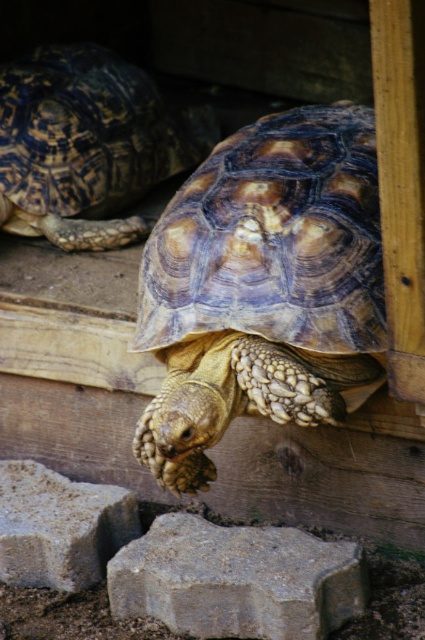
You are a zookeeper who needs to place a new feeding dish on the gray textured stone at lower left. Can you confirm if the shiny brown tortoise at upper left is blocking the area where you want to place it?

The shiny brown tortoise at upper left is above the gray textured stone at lower left, so it is blocking the area where you want to place the feeding dish.

You are standing in front of a wooden enclosure with two tortoises. You notice a point marked at coordinates (87, 145). What is located at that point?

The point at (87, 145) is occupied by the shiny brown tortoise at upper left.